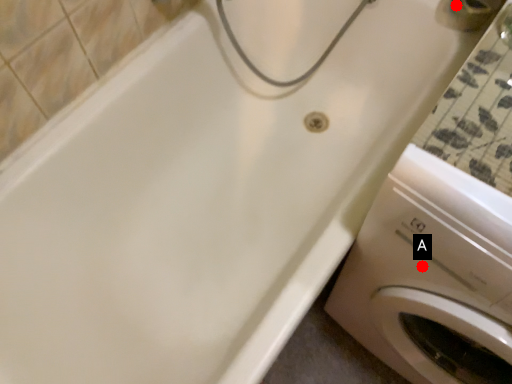
Question: Two points are circled on the image, labeled by A and B beside each circle. Which point is closer to the camera?

Choices:
 (A) A is closer
 (B) B is closer

Answer: (A)